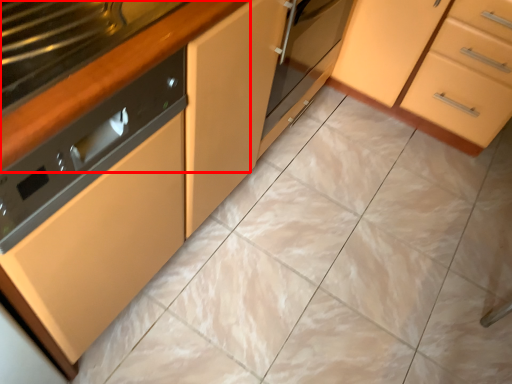
Question: From the image, what is the correct spatial relationship of counter top (annotated by the red box) in relation to cabinetry?

Choices:
 (A) right
 (B) left

Answer: (B)